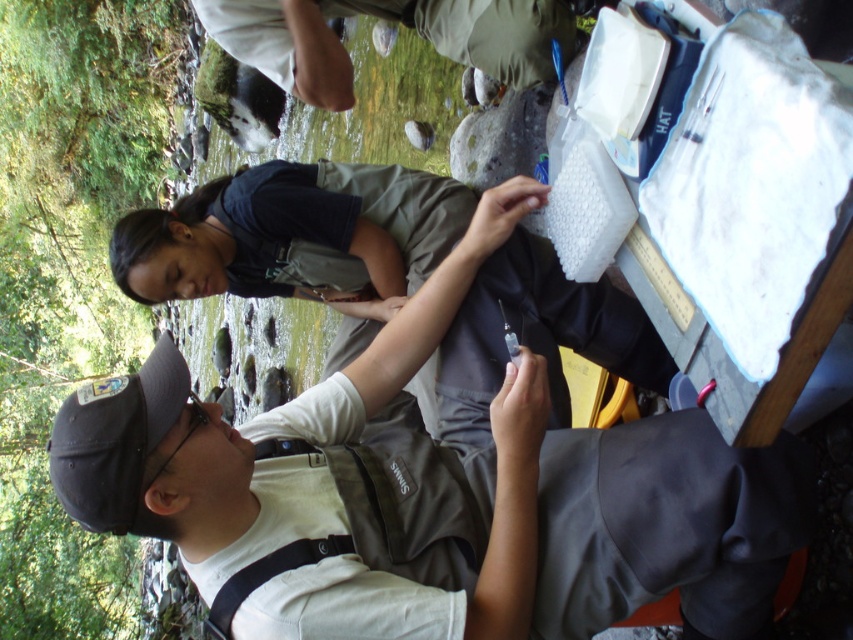
Does point (440, 417) come in front of point (454, 17)?

Yes, it is.

Where is `dark gray uniform at center`? dark gray uniform at center is located at coordinates (294, 234).

This screenshot has width=853, height=640. I want to click on dark gray uniform at center, so click(294, 234).

Can you confirm if matte gray vest at center is smaller than dark gray uniform at center?

Actually, matte gray vest at center might be larger than dark gray uniform at center.

Does matte gray vest at center lie behind dark gray uniform at center?

No, it is not.

Where is `matte gray vest at center`? The image size is (853, 640). matte gray vest at center is located at coordinates (432, 496).

Can you confirm if matte gray vest at center is wider than light beige fabric pants at upper center?

Yes, matte gray vest at center is wider than light beige fabric pants at upper center.

Which is more to the left, matte gray vest at center or light beige fabric pants at upper center?

From the viewer's perspective, light beige fabric pants at upper center appears more on the left side.

Does point (157, 369) come farther from viewer compared to point (292, 83)?

No, it is not.

You are a GUI agent. You are given a task and a screenshot of the screen. Output one action in this format:
    pyautogui.click(x=<x>, y=<y>)
    Task: Click on the matte gray vest at center
    This screenshot has height=640, width=853.
    Given the screenshot: What is the action you would take?
    pyautogui.click(x=432, y=496)